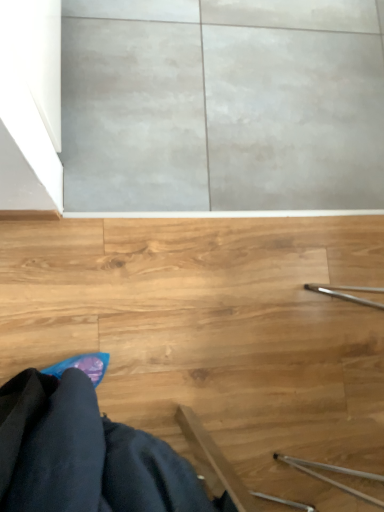
Question: Should I look upward or downward to see wooden stairs at lower right?

Choices:
 (A) up
 (B) down

Answer: (A)

Question: From a real-world perspective, is wooden stairs at lower right under black fabric robe at lower left?

Choices:
 (A) yes
 (B) no

Answer: (A)

Question: Is wooden stairs at lower right smaller than black fabric robe at lower left?

Choices:
 (A) no
 (B) yes

Answer: (A)

Question: Does wooden stairs at lower right have a greater width compared to black fabric robe at lower left?

Choices:
 (A) yes
 (B) no

Answer: (A)

Question: From the image's perspective, does wooden stairs at lower right appear lower than black fabric robe at lower left?

Choices:
 (A) no
 (B) yes

Answer: (A)

Question: Considering the relative positions of wooden stairs at lower right and black fabric robe at lower left in the image provided, is wooden stairs at lower right to the left of black fabric robe at lower left from the viewer's perspective?

Choices:
 (A) yes
 (B) no

Answer: (B)

Question: Is wooden stairs at lower right surrounding black fabric robe at lower left?

Choices:
 (A) no
 (B) yes

Answer: (A)

Question: Can you confirm if black fabric robe at lower left is smaller than wooden stairs at lower right?

Choices:
 (A) yes
 (B) no

Answer: (A)

Question: Is black fabric robe at lower left positioned with its back to wooden stairs at lower right?

Choices:
 (A) yes
 (B) no

Answer: (B)

Question: Is the depth of black fabric robe at lower left greater than that of wooden stairs at lower right?

Choices:
 (A) no
 (B) yes

Answer: (A)

Question: Does black fabric robe at lower left have a lesser height compared to wooden stairs at lower right?

Choices:
 (A) yes
 (B) no

Answer: (B)

Question: Considering the relative sizes of black fabric robe at lower left and wooden stairs at lower right in the image provided, is black fabric robe at lower left thinner than wooden stairs at lower right?

Choices:
 (A) yes
 (B) no

Answer: (A)

Question: From a real-world perspective, is black fabric robe at lower left beneath wooden stairs at lower right?

Choices:
 (A) no
 (B) yes

Answer: (A)

Question: Considering the positions of point (31, 486) and point (16, 225), is point (31, 486) closer or farther from the camera than point (16, 225)?

Choices:
 (A) farther
 (B) closer

Answer: (B)